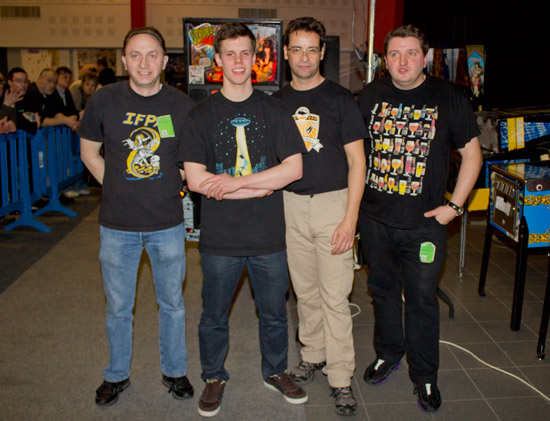
At what (x,y) coordinates should I click in order to perform the action: click on gray carpet. Please return your answer as a coordinate pair (x, y). Image resolution: width=550 pixels, height=421 pixels. Looking at the image, I should click on (38, 378).